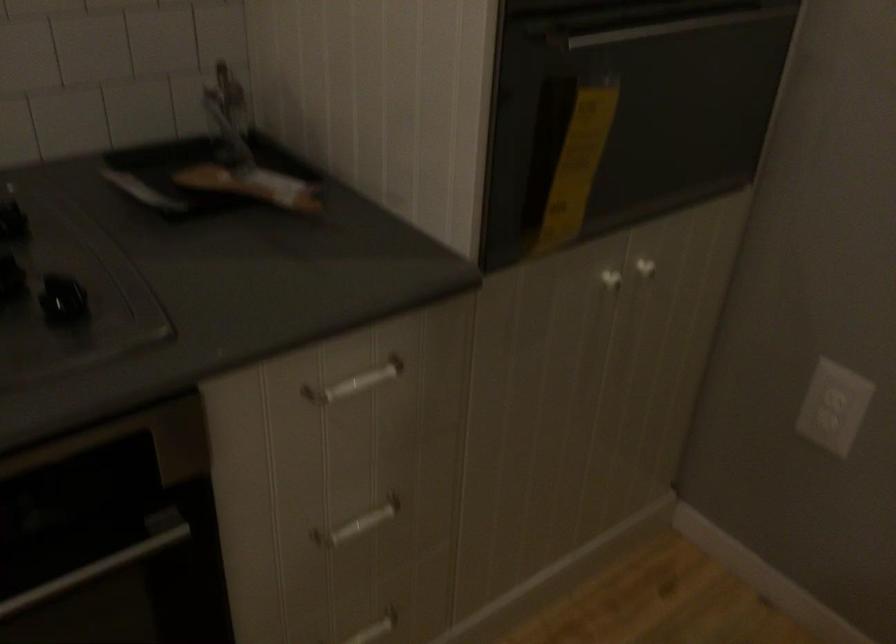
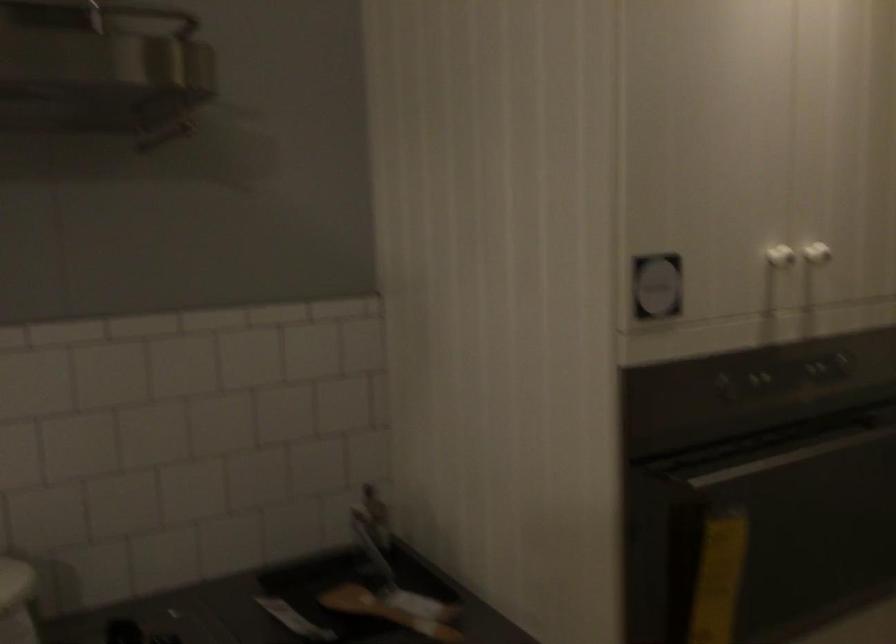
Question: The images are taken continuously from a first-person perspective. In which direction are you moving?

Choices:
 (A) Left
 (B) Right
 (C) Forward
 (D) Backward

Answer: (D)